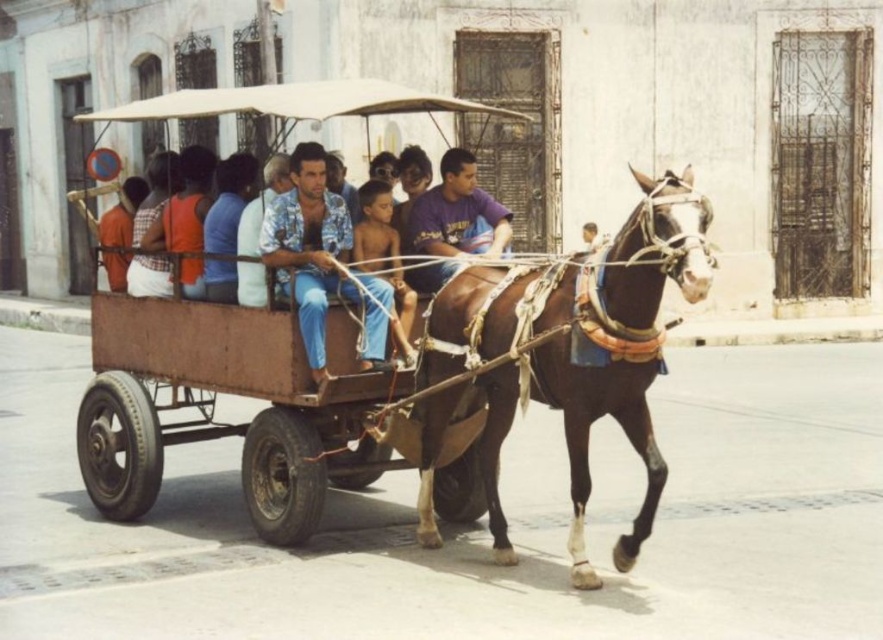
Question: Based on their relative distances, which object is nearer to the purple cotton shirt at center?

Choices:
 (A) rusty metal wagon at center
 (B) floral shirt at center

Answer: (B)

Question: Among these points, which one is nearest to the camera?

Choices:
 (A) (499, 276)
 (B) (429, 189)
 (C) (106, 497)

Answer: (A)

Question: Does brown glossy horse at center appear under purple cotton shirt at center?

Choices:
 (A) no
 (B) yes

Answer: (B)

Question: Does rusty metal wagon at center appear under brown glossy horse at center?

Choices:
 (A) no
 (B) yes

Answer: (B)

Question: Does rusty metal wagon at center appear over purple cotton shirt at center?

Choices:
 (A) yes
 (B) no

Answer: (B)

Question: Based on their relative distances, which object is farther from the brown glossy horse at center?

Choices:
 (A) rusty metal wagon at center
 (B) purple cotton shirt at center
 (C) floral shirt at center

Answer: (A)